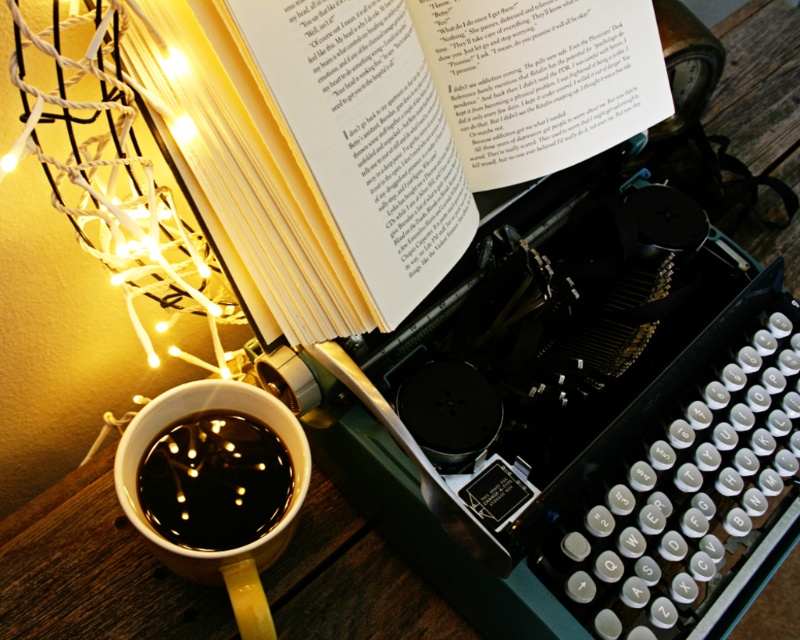
Question: Is white paper book at upper center thinner than black glossy mug at lower left?

Choices:
 (A) yes
 (B) no

Answer: (B)

Question: Which of the following is the farthest from the observer?

Choices:
 (A) (193, 470)
 (B) (154, 486)

Answer: (A)

Question: Which point is farther to the camera?

Choices:
 (A) (260, 500)
 (B) (293, 522)

Answer: (A)

Question: Based on their relative distances, which object is farther from the matte ceramic mug at lower left?

Choices:
 (A) black glossy mug at lower left
 (B) white paper book at upper center

Answer: (B)

Question: Can you confirm if white paper book at upper center is smaller than matte ceramic mug at lower left?

Choices:
 (A) no
 (B) yes

Answer: (A)

Question: From the image, what is the correct spatial relationship of white paper book at upper center in relation to black glossy mug at lower left?

Choices:
 (A) below
 (B) above

Answer: (B)